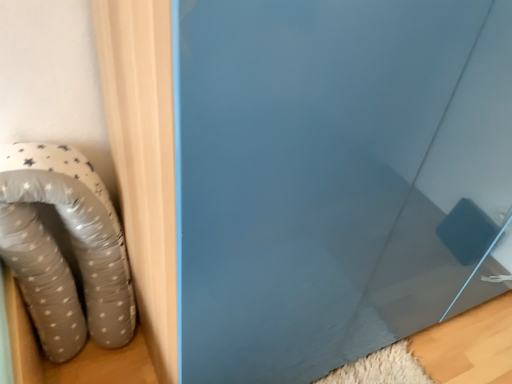
Describe the element at coordinates (59, 249) in the screenshot. Image resolution: width=512 pixels, height=384 pixels. I see `white dotted fabric pillow at left` at that location.

Where is `white dotted fabric pillow at left`? white dotted fabric pillow at left is located at coordinates (59, 249).

Where is `white dotted fabric pillow at left`? Image resolution: width=512 pixels, height=384 pixels. white dotted fabric pillow at left is located at coordinates (59, 249).